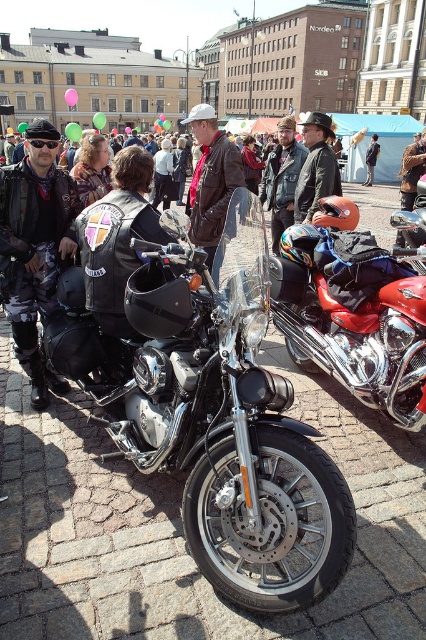
In the scene shown: Between brown leather jacket at center and leather jacket at center, which one is positioned higher?

brown leather jacket at center

Is brown leather jacket at center below leather jacket at center?

Incorrect, brown leather jacket at center is not positioned below leather jacket at center.

Which is in front, point (201, 204) or point (314, 136)?

Point (201, 204) is more forward.

Identify the location of brown leather jacket at center. (210, 179).

Is shiny chrome motorcycle at center closer to the viewer compared to leather jacket at center?

Yes, it is in front of leather jacket at center.

Which of these two, shiny chrome motorcycle at center or leather jacket at center, stands shorter?

Standing shorter between the two is shiny chrome motorcycle at center.

The width and height of the screenshot is (426, 640). What are the coordinates of `shiny chrome motorcycle at center` in the screenshot? It's located at (354, 310).

Between point (224, 355) and point (304, 220), which one is positioned in front?

Positioned in front is point (224, 355).

Is point (242, 497) behind point (311, 115)?

That is False.

Who is more distant from viewer, (192, 470) or (313, 138)?

Positioned behind is point (313, 138).

This screenshot has height=640, width=426. I want to click on polished chrome motorcycle at center, so click(216, 417).